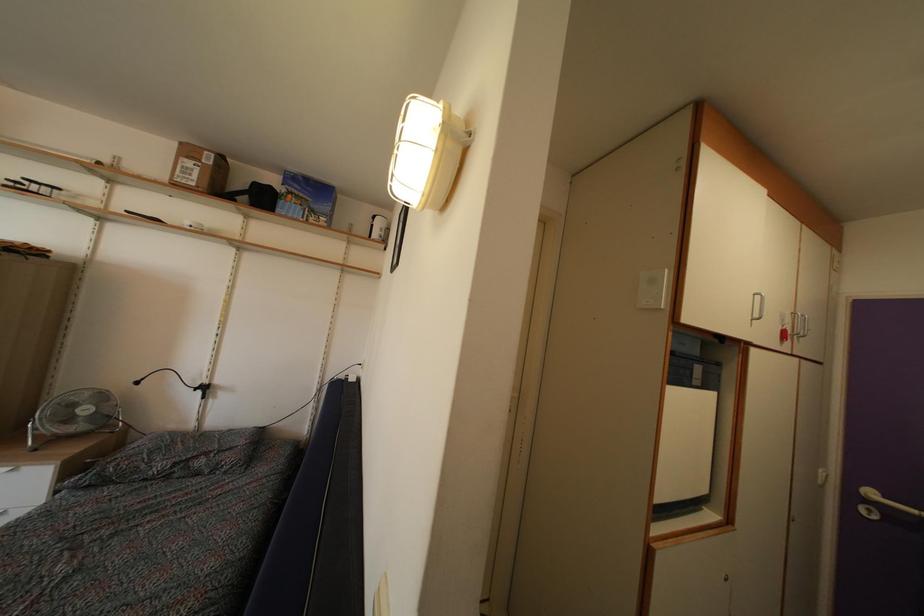
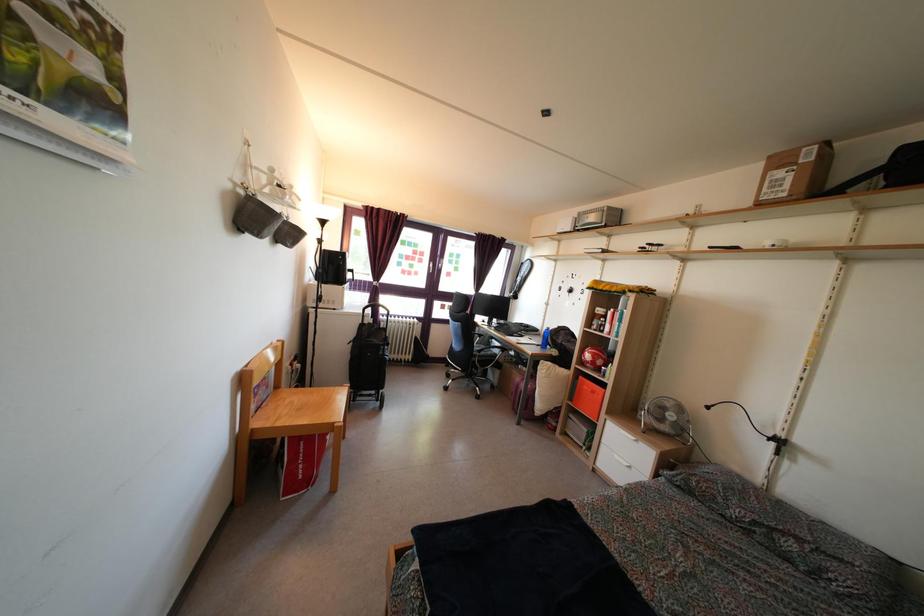
Question: The first image is from the beginning of the video and the second image is from the end. How did the camera likely rotate when shooting the video?

Choices:
 (A) Left
 (B) Right
 (C) Up
 (D) Down

Answer: (A)